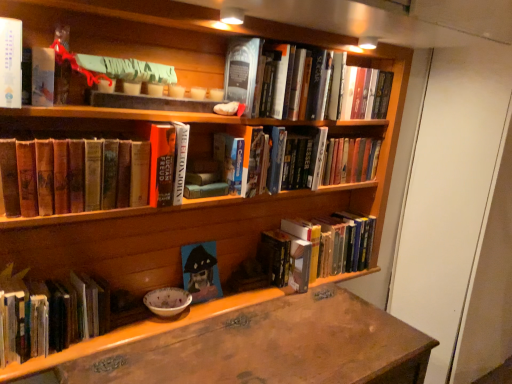
Question: Is matte blue canvas painting at center, which appears as the 5th book when viewed from the left, outside of hardcover book at center, marked as the 4th book in a right-to-left arrangement?

Choices:
 (A) yes
 (B) no

Answer: (A)

Question: Is matte blue canvas painting at center, which appears as the 5th book when viewed from the left, with hardcover book at center, marked as the 4th book in a right-to-left arrangement?

Choices:
 (A) no
 (B) yes

Answer: (A)

Question: Is hardcover book at center, placed as the fourth book when sorted from left to right, surrounded by matte blue canvas painting at center, which appears as the 5th book when viewed from the left?

Choices:
 (A) no
 (B) yes

Answer: (A)

Question: Is the position of matte blue canvas painting at center, the third book positioned from the right, less distant than that of hardcover book at center, marked as the 4th book in a right-to-left arrangement?

Choices:
 (A) no
 (B) yes

Answer: (A)

Question: Can you confirm if matte blue canvas painting at center, which appears as the 5th book when viewed from the left, is taller than hardcover book at center, marked as the 4th book in a right-to-left arrangement?

Choices:
 (A) yes
 (B) no

Answer: (B)

Question: From the image's perspective, does matte blue canvas painting at center, the third book positioned from the right, appear higher than hardcover book at center, placed as the fourth book when sorted from left to right?

Choices:
 (A) yes
 (B) no

Answer: (B)

Question: Is hardcover book at center, placed as the fourth book when sorted from left to right, smaller than wooden desk at lower center?

Choices:
 (A) yes
 (B) no

Answer: (A)

Question: From a real-world perspective, does hardcover book at center, placed as the fourth book when sorted from left to right, sit lower than wooden desk at lower center?

Choices:
 (A) yes
 (B) no

Answer: (B)

Question: Is hardcover book at center, placed as the fourth book when sorted from left to right, far away from wooden desk at lower center?

Choices:
 (A) yes
 (B) no

Answer: (B)

Question: Is hardcover book at center, marked as the 4th book in a right-to-left arrangement, directly adjacent to wooden desk at lower center?

Choices:
 (A) no
 (B) yes

Answer: (A)

Question: Is hardcover book at center, placed as the fourth book when sorted from left to right, at the left side of wooden desk at lower center?

Choices:
 (A) yes
 (B) no

Answer: (A)

Question: Is hardcover book at center, placed as the fourth book when sorted from left to right, closer to the viewer compared to wooden desk at lower center?

Choices:
 (A) yes
 (B) no

Answer: (B)

Question: Is wooden desk at lower center turned away from hardcover book at upper center, the 2th book from the right?

Choices:
 (A) no
 (B) yes

Answer: (A)